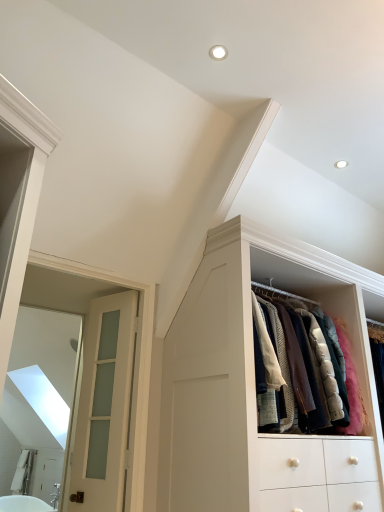
Question: Do you think white wood cabinet at upper right is within white frosted glass door at left, or outside of it?

Choices:
 (A) outside
 (B) inside

Answer: (A)

Question: In the image, is white wood cabinet at upper right positioned in front of or behind white frosted glass door at left?

Choices:
 (A) front
 (B) behind

Answer: (A)

Question: Considering the real-world distances, which object is closest to the white frosted glass door at left?

Choices:
 (A) white glossy bathtub at lower left
 (B) white wood cabinet at upper right

Answer: (B)

Question: Based on their relative distances, which object is nearer to the white glossy bathtub at lower left?

Choices:
 (A) white frosted glass door at left
 (B) white wood cabinet at upper right

Answer: (A)